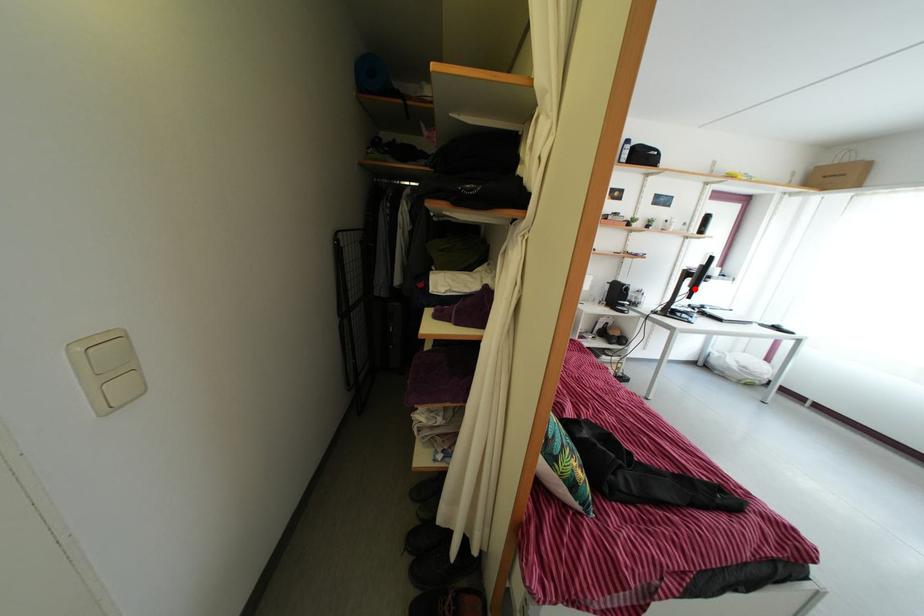
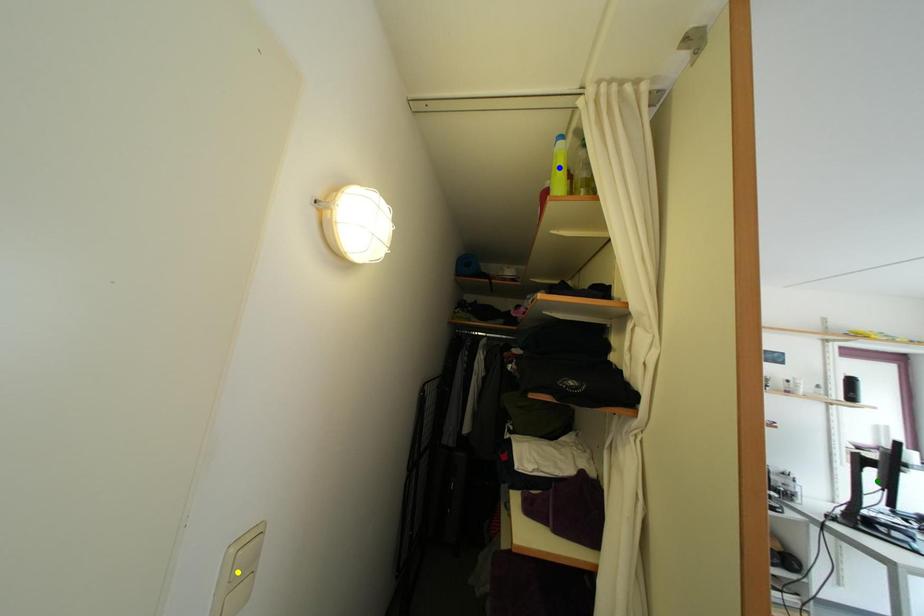
Question: I am providing you with two images of the same scene from different viewpoints. A red point is marked on the first image. You are given multiple points on the second image. Which point in image 2 is actually the same real-world point as the red point in image 1?

Choices:
 (A) yellow point
 (B) blue point
 (C) green point

Answer: (C)